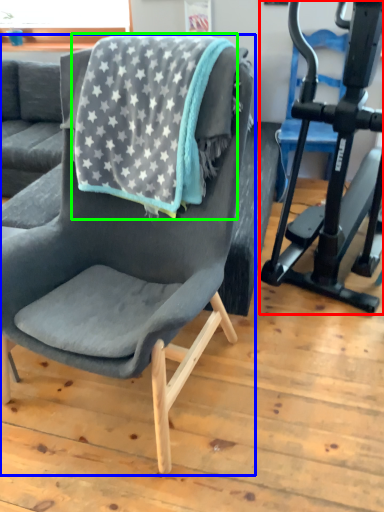
Question: Which is nearer to the stationary bicycle (highlighted by a red box)? chair (highlighted by a blue box) or beach towel (highlighted by a green box).

Choices:
 (A) chair
 (B) beach towel

Answer: (B)